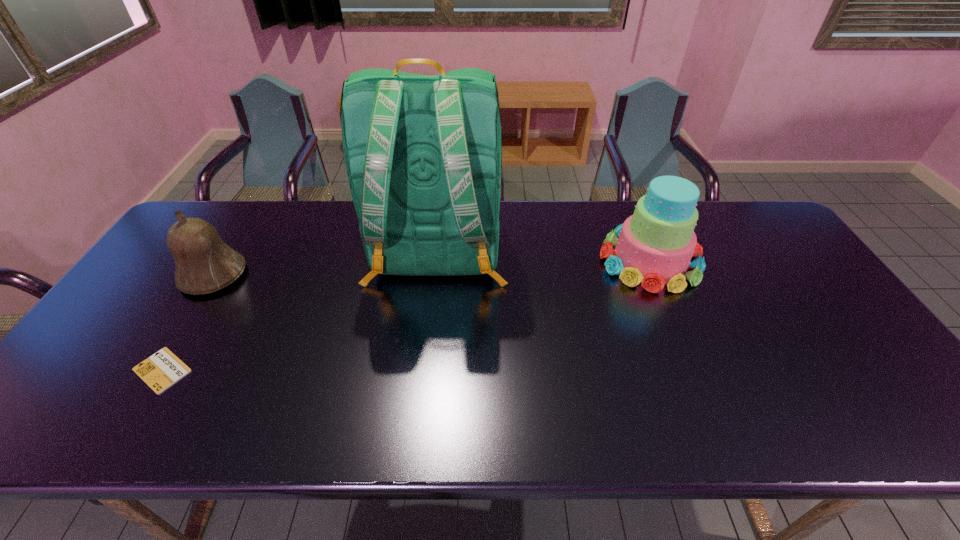
Locate which object ranks in proximity to the cake. Please provide its 2D coordinates. Your answer should be formatted as a tuple, i.e. [(x, y)], where the tuple contains the x and y coordinates of a point satisfying the conditions above.

[(423, 154)]

Identify the location of free region that satisfies the following two spatial constraints: 1. on the back of the tallest object; 2. on the left side of the rightmost object. (437, 260).

You are a GUI agent. You are given a task and a screenshot of the screen. Output one action in this format:
    pyautogui.click(x=<x>, y=<y>)
    Task: Click on the vacant area that satisfies the following two spatial constraints: 1. on the back of the cake; 2. on the right side of the backpack
    This screenshot has width=960, height=540.
    Given the screenshot: What is the action you would take?
    pyautogui.click(x=437, y=260)